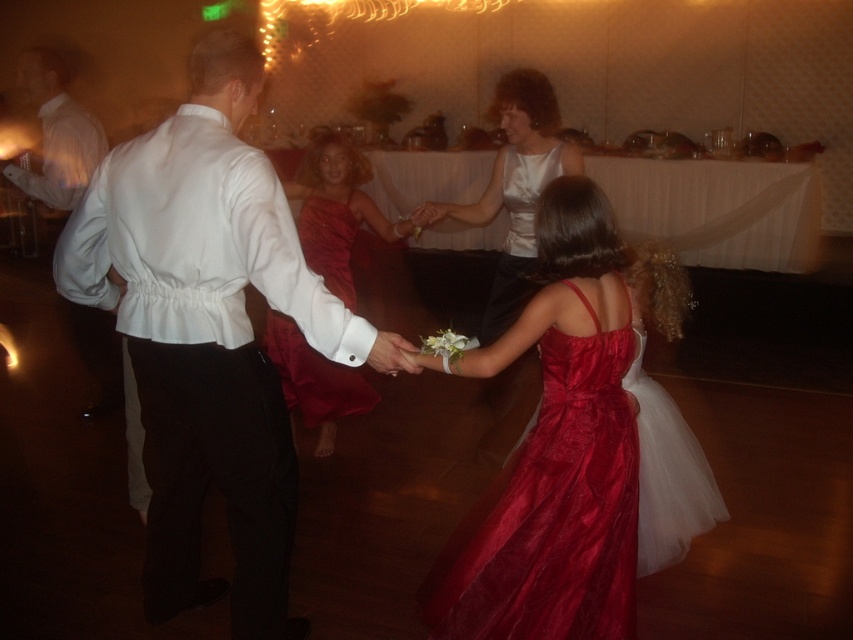
You are standing at the center of the dance floor and want to find the white satin shirt at left. Based on the coordinates provided, in which direction should you look to locate it?

The white satin shirt at left is located at coordinates point (x=209, y=333), so you should look to the left side of the dance floor to find it.

You are a photographer at the event and need to capture a group photo of the two dresses at the center. Since the shiny satin dress at center is narrower than the satin white dress at center, will you position them side by side without overlapping?

Yes, the shiny satin dress at center is narrower than the satin white dress at center, so positioning them side by side without overlapping is possible as there will be enough space between them.

Looking at this image, you are a photographer at the event and want to capture a photo of both the white satin shirt at left and the shiny satin dress at lower right. However, you need to ensure that both subjects are fully visible in the frame. Based on their positions, can you position yourself in a way that both are visible without one blocking the other?

The white satin shirt at left is in front of the shiny satin dress at lower right, so to capture both fully visible, the photographer should position themselves from the side opposite to the current front position to avoid the white satin shirt at left blocking the shiny satin dress at lower right.